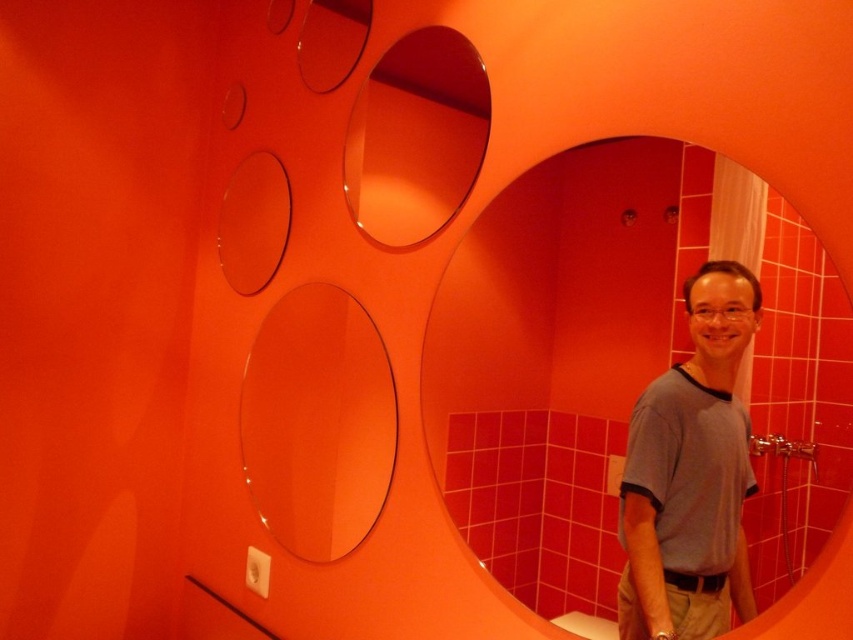
Question: Considering the real-world distances, which object is farthest from the transparent glass mirror at upper center?

Choices:
 (A) transparent glass mirror at center
 (B) transparent glass oval at center

Answer: (B)

Question: Estimate the real-world distances between objects in this image. Which object is farther from the transparent glass oval at center?

Choices:
 (A) gray cotton shirt at center
 (B) transparent glass mirror at upper center
 (C) transparent glass mirror at center

Answer: (A)

Question: Is transparent glass oval at center to the left of transparent glass mirror at upper center from the viewer's perspective?

Choices:
 (A) yes
 (B) no

Answer: (A)

Question: Does gray cotton shirt at center have a larger size compared to transparent glass oval at center?

Choices:
 (A) no
 (B) yes

Answer: (A)

Question: Which point is closer to the camera?

Choices:
 (A) transparent glass oval at center
 (B) gray cotton shirt at center
 (C) transparent glass mirror at upper center
 (D) transparent glass mirror at center

Answer: (D)

Question: Is transparent glass mirror at center further to camera compared to gray cotton shirt at center?

Choices:
 (A) yes
 (B) no

Answer: (B)